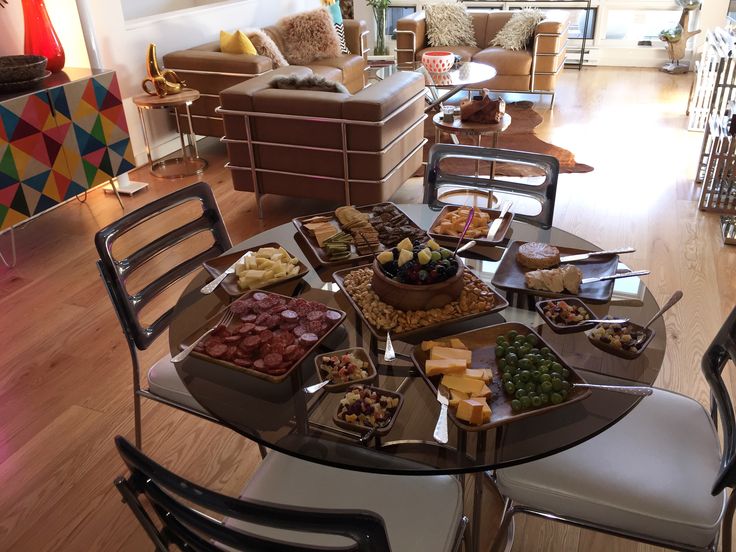
Find the location of a particular element. The width and height of the screenshot is (736, 552). coffee table is located at coordinates (464, 74).